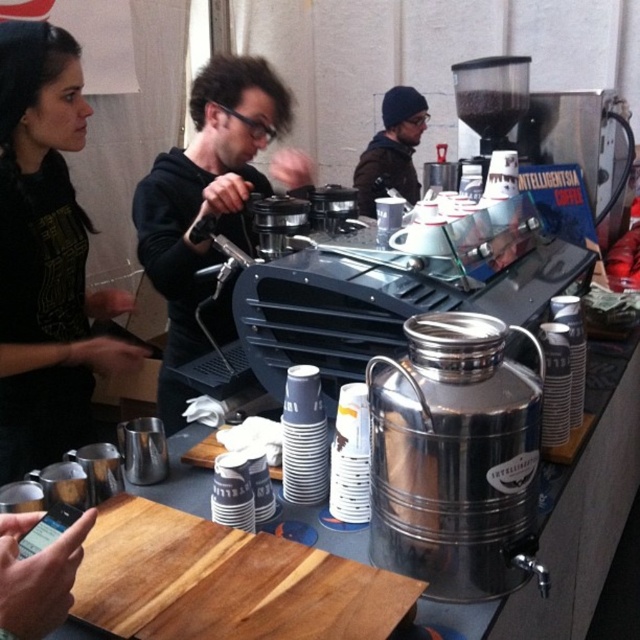
Question: Which point is closer to the camera?

Choices:
 (A) brown fuzzy beanie at upper center
 (B) metallic silver grinder at upper right
 (C) black matte hoodie at center

Answer: (C)

Question: Does black fabric shirt at left lie in front of metallic silver grinder at upper right?

Choices:
 (A) yes
 (B) no

Answer: (A)

Question: Considering the real-world distances, which object is closest to the brown fuzzy beanie at upper center?

Choices:
 (A) metallic silver grinder at upper right
 (B) black fabric shirt at left

Answer: (A)

Question: Can you confirm if black matte hoodie at center is thinner than metallic silver grinder at upper right?

Choices:
 (A) no
 (B) yes

Answer: (A)

Question: Estimate the real-world distances between objects in this image. Which object is farther from the black fabric shirt at left?

Choices:
 (A) metallic silver grinder at upper right
 (B) brown fuzzy beanie at upper center

Answer: (B)

Question: Considering the relative positions of black fabric shirt at left and black matte hoodie at center in the image provided, where is black fabric shirt at left located with respect to black matte hoodie at center?

Choices:
 (A) left
 (B) right

Answer: (A)